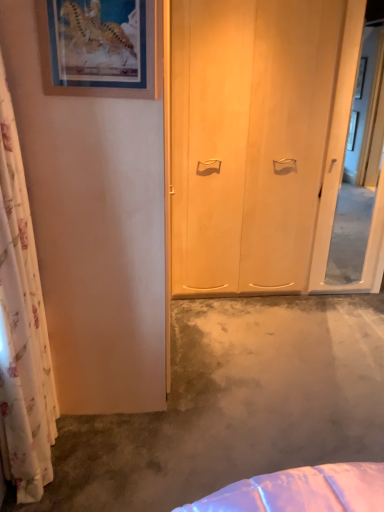
Question: Does white floral curtain at left have a smaller size compared to transparent glass screen door at right?

Choices:
 (A) no
 (B) yes

Answer: (A)

Question: Does white floral curtain at left have a lesser height compared to transparent glass screen door at right?

Choices:
 (A) no
 (B) yes

Answer: (B)

Question: Considering the relative sizes of white floral curtain at left and transparent glass screen door at right in the image provided, is white floral curtain at left taller than transparent glass screen door at right?

Choices:
 (A) no
 (B) yes

Answer: (A)

Question: Is transparent glass screen door at right completely or partially inside white floral curtain at left?

Choices:
 (A) no
 (B) yes

Answer: (A)

Question: Is white floral curtain at left not inside transparent glass screen door at right?

Choices:
 (A) no
 (B) yes

Answer: (B)

Question: Does white floral curtain at left lie behind transparent glass screen door at right?

Choices:
 (A) no
 (B) yes

Answer: (A)

Question: Is wooden picture frame at upper left next to concreteroughconcrete at center?

Choices:
 (A) no
 (B) yes

Answer: (A)

Question: Does wooden picture frame at upper left have a larger size compared to concreteroughconcrete at center?

Choices:
 (A) yes
 (B) no

Answer: (B)

Question: From the image's perspective, is wooden picture frame at upper left on concreteroughconcrete at center?

Choices:
 (A) no
 (B) yes

Answer: (B)

Question: Is wooden picture frame at upper left not inside concreteroughconcrete at center?

Choices:
 (A) no
 (B) yes

Answer: (B)

Question: Can you confirm if wooden picture frame at upper left is wider than concreteroughconcrete at center?

Choices:
 (A) no
 (B) yes

Answer: (A)

Question: Is wooden picture frame at upper left facing away from concreteroughconcrete at center?

Choices:
 (A) no
 (B) yes

Answer: (A)

Question: From a real-world perspective, does transparent glass screen door at right sit lower than concreteroughconcrete at center?

Choices:
 (A) no
 (B) yes

Answer: (A)